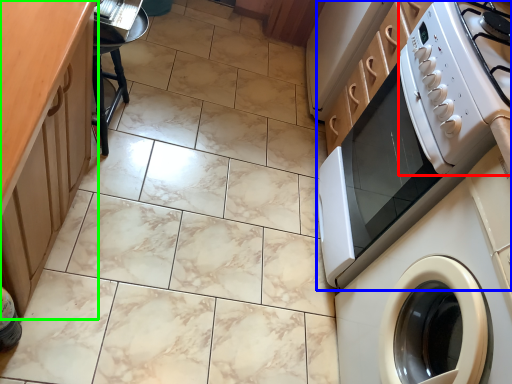
Question: Which object is positioned closest to gas stove (highlighted by a red box)? Select from home appliance (highlighted by a blue box) and counter top (highlighted by a green box).

Choices:
 (A) home appliance
 (B) counter top

Answer: (A)